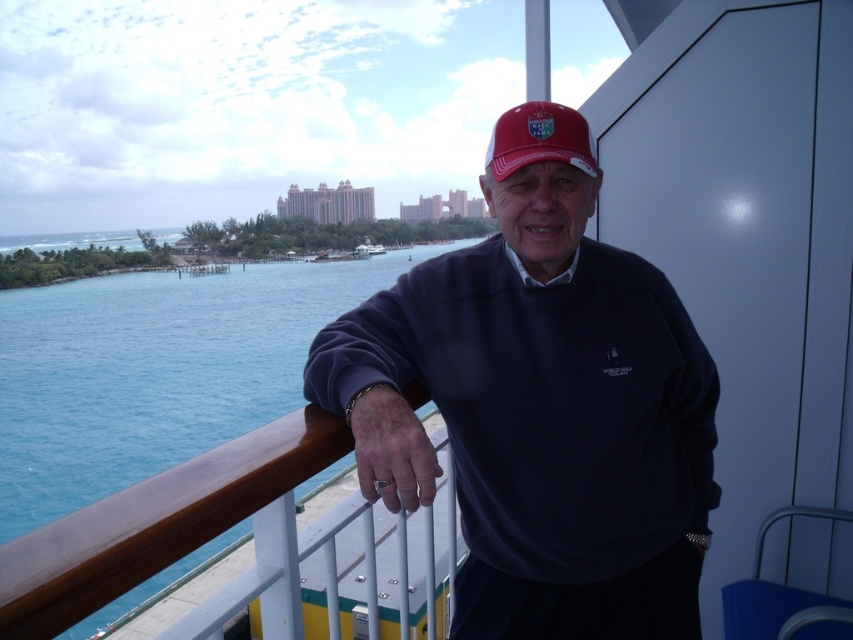
Does matte navy blue sweater at center lie behind matte red cap at center?

No, it is not.

In order to click on matte navy blue sweater at center in this screenshot , I will do `click(540, 419)`.

Where is `matte navy blue sweater at center`? The height and width of the screenshot is (640, 853). matte navy blue sweater at center is located at coordinates (540, 419).

Is matte navy blue sweater at center above blue water at left?

Actually, matte navy blue sweater at center is below blue water at left.

What do you see at coordinates (540, 419) in the screenshot? This screenshot has height=640, width=853. I see `matte navy blue sweater at center` at bounding box center [540, 419].

At what (x,y) coordinates should I click in order to perform the action: click on matte navy blue sweater at center. Please return your answer as a coordinate pair (x, y). Looking at the image, I should click on (540, 419).

Is blue water at left bigger than matte red cap at center?

Correct, blue water at left is larger in size than matte red cap at center.

The height and width of the screenshot is (640, 853). Identify the location of blue water at left. (155, 371).

Is point (70, 326) positioned after point (512, 157)?

Yes, it is.

I want to click on blue water at left, so click(x=155, y=371).